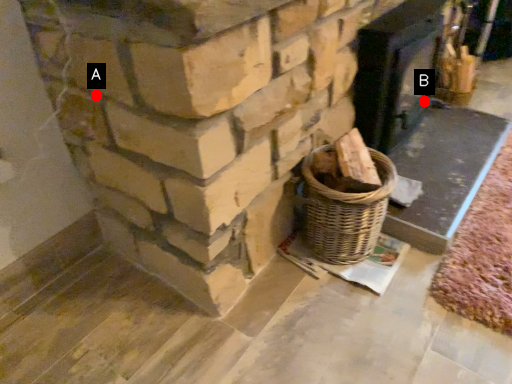
Question: Two points are circled on the image, labeled by A and B beside each circle. Which point appears farthest from the camera in this image?

Choices:
 (A) A is further
 (B) B is further

Answer: (B)